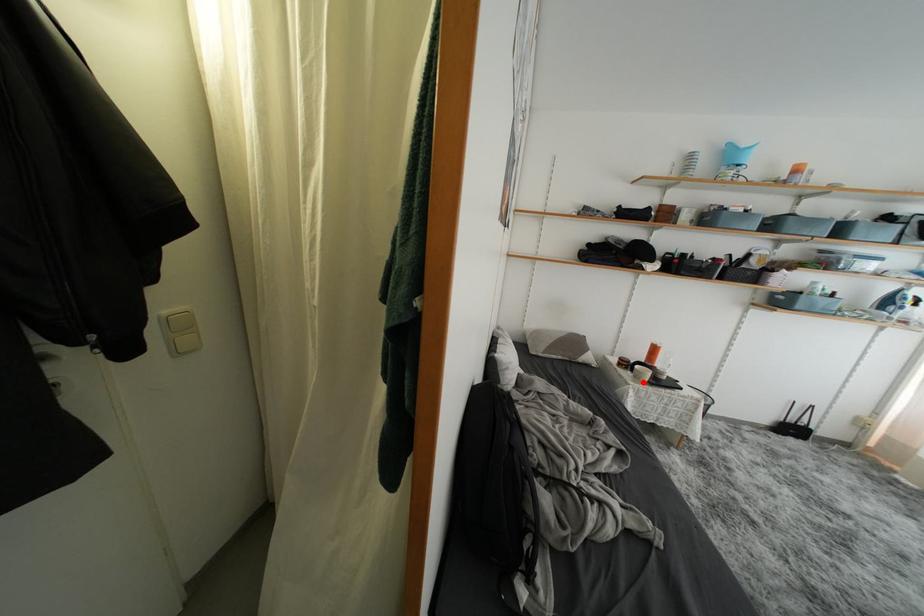
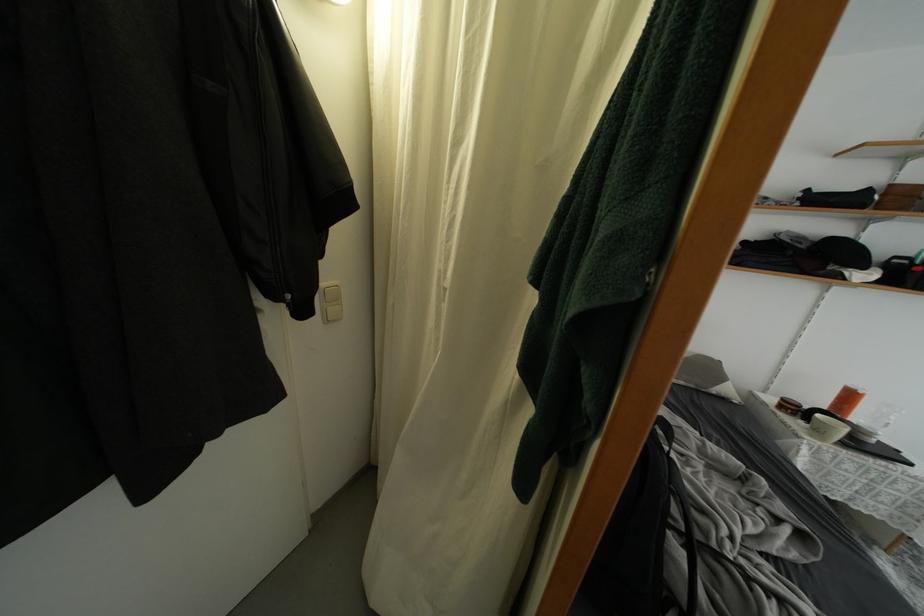
The point at the highlighted location is marked in the first image. Where is the corresponding point in the second image?

(823, 437)